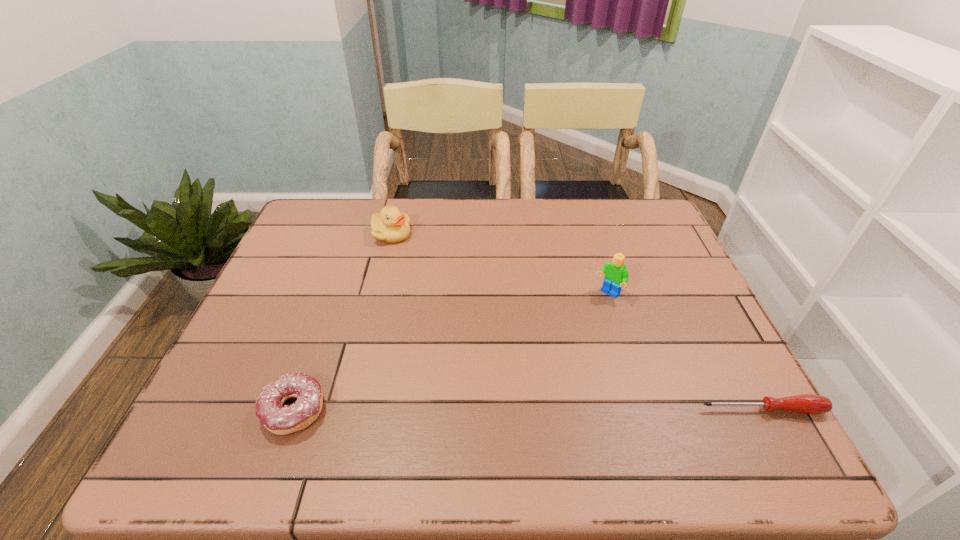
Locate an element on the screen. object present at the near right corner is located at coordinates (807, 403).

Find the location of a particular element. This screenshot has height=540, width=960. blank area at the far edge is located at coordinates (426, 218).

The width and height of the screenshot is (960, 540). I want to click on free region at the near edge, so click(x=463, y=401).

I want to click on vacant space at the left edge, so click(230, 357).

Where is `vacant space at the right edge`? The height and width of the screenshot is (540, 960). vacant space at the right edge is located at coordinates (677, 248).

In the image, there is a desktop. In order to click on vacant region at the far left corner in this screenshot , I will do `click(334, 241)`.

Image resolution: width=960 pixels, height=540 pixels. In the image, there is a desktop. In order to click on vacant space at the far right corner in this screenshot , I will do `click(641, 202)`.

This screenshot has width=960, height=540. I want to click on free space between the rightmost object and the third tallest object, so click(528, 410).

The image size is (960, 540). I want to click on free spot between the second tallest object and the doughnut, so click(343, 322).

Identify the location of free spot between the third nearest object and the second tallest object. The width and height of the screenshot is (960, 540). (499, 264).